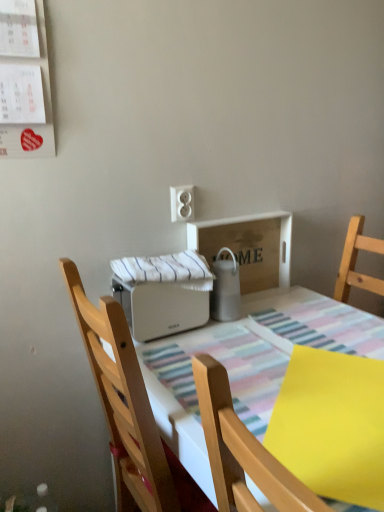
Question: Is satin silver thermos at center, arranged as the first appliance when viewed from the right, to the left or to the right of white plastic toaster at center in the image?

Choices:
 (A) left
 (B) right

Answer: (A)

Question: Considering the positions of satin silver thermos at center, arranged as the first appliance when viewed from the right, and white plastic toaster at center in the image, is satin silver thermos at center, arranged as the first appliance when viewed from the right, bigger or smaller than white plastic toaster at center?

Choices:
 (A) big
 (B) small

Answer: (B)

Question: Which is nearer to the white plastic outlet at upper center?

Choices:
 (A) satin silver thermos at center, which is the 2th appliance in left-to-right order
 (B) white matte toaster at center, arranged as the first appliance when viewed from the left
 (C) wooden tray at center
 (D) wooden chair at center
 (E) yellow matte paper at lower right

Answer: (A)

Question: Based on their relative distances, which object is nearer to the satin silver thermos at center, arranged as the first appliance when viewed from the right?

Choices:
 (A) white matte toaster at center, arranged as the first appliance when viewed from the left
 (B) yellow matte paper at lower right
 (C) white plastic outlet at upper center
 (D) wooden chair at center
 (E) wooden tray at center

Answer: (E)